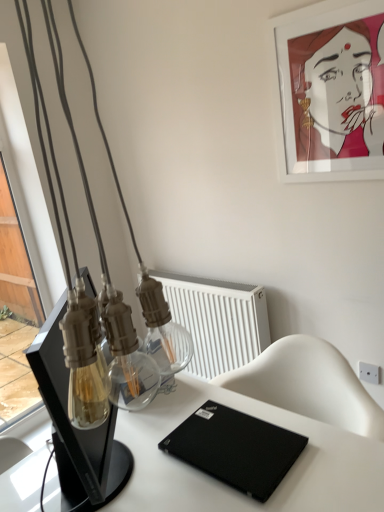
Describe the element at coordinates (235, 448) in the screenshot. I see `black matte laptop at lower right` at that location.

I want to click on white plastic electric outlet at upper right, so click(x=369, y=373).

Find the location of `white matte picture frame at upper right`. white matte picture frame at upper right is located at coordinates (330, 93).

Would you say black matte laptop at lower right is outside black matte laptop at center?

No, black matte laptop at lower right is inside black matte laptop at center's boundary.

Can you confirm if black matte laptop at lower right is bigger than black matte laptop at center?

No.

Is black matte laptop at lower right positioned with its back to black matte laptop at center?

Absolutely, black matte laptop at lower right is directed away from black matte laptop at center.

From a real-world perspective, relative to black matte laptop at center, is black matte laptop at lower right vertically above or below?

black matte laptop at lower right is situated higher than black matte laptop at center in the real world.

Considering the relative sizes of black matte laptop at lower right and white matte picture frame at upper right in the image provided, is black matte laptop at lower right bigger than white matte picture frame at upper right?

No, black matte laptop at lower right is not bigger than white matte picture frame at upper right.

Is black matte laptop at lower right oriented away from white matte picture frame at upper right?

black matte laptop at lower right does not have its back to white matte picture frame at upper right.

Is point (278, 426) closer to viewer compared to point (320, 16)?

Yes, point (278, 426) is closer to viewer.

From a real-world perspective, is black matte laptop at lower right on white matte picture frame at upper right?

No, from a real-world perspective, black matte laptop at lower right is not above white matte picture frame at upper right.

From a real-world perspective, between clear glass bottle at center and black matte laptop at lower right, who is vertically higher?

clear glass bottle at center is physically above.

Between clear glass bottle at center and black matte laptop at lower right, which one has larger width?

black matte laptop at lower right.

Is clear glass bottle at center bigger or smaller than black matte laptop at lower right?

In the image, clear glass bottle at center appears to be smaller than black matte laptop at lower right.

Considering the positions of objects black matte laptop at lower right and white plastic radiator at center in the image provided, who is in front, black matte laptop at lower right or white plastic radiator at center?

black matte laptop at lower right is closer to the camera.

Consider the image. Considering the sizes of black matte laptop at lower right and white plastic radiator at center in the image, is black matte laptop at lower right wider or thinner than white plastic radiator at center?

Considering their sizes, black matte laptop at lower right looks broader than white plastic radiator at center.

Could white plastic radiator at center be considered to be inside black matte laptop at lower right?

That's incorrect, white plastic radiator at center is not inside black matte laptop at lower right.

In the scene shown: Which object is positioned more to the left, black matte laptop at lower right or white plastic radiator at center?

white plastic radiator at center is more to the left.

From a real-world perspective, is white plastic radiator at center located beneath white matte picture frame at upper right?

Indeed, from a real-world perspective, white plastic radiator at center is positioned beneath white matte picture frame at upper right.

Can you tell me how much white plastic radiator at center and white matte picture frame at upper right differ in facing direction?

0.00418 degrees.

From the image's perspective, would you say white plastic radiator at center is positioned over white matte picture frame at upper right?

Actually, white plastic radiator at center appears below white matte picture frame at upper right in the image.

Does white plastic radiator at center have a greater width compared to white matte picture frame at upper right?

Indeed, white plastic radiator at center has a greater width compared to white matte picture frame at upper right.

From the image's perspective, is black matte laptop at center under white matte picture frame at upper right?

Yes, from the image's perspective, black matte laptop at center is below white matte picture frame at upper right.

Can you tell me how much black matte laptop at center and white matte picture frame at upper right differ in facing direction?

There is a 0.00385-degree angle between the facing directions of black matte laptop at center and white matte picture frame at upper right.

Does point (315, 453) appear closer or farther from the camera than point (309, 67)?

Point (315, 453) is closer to the camera than point (309, 67).

From a real-world perspective, which object rests below the other?

black matte laptop at center, from a real-world perspective.

Image resolution: width=384 pixels, height=512 pixels. Identify the location of picture frame in front of the white plastic electric outlet at upper right. (330, 93).

Is white plastic electric outlet at upper right next to white matte picture frame at upper right and touching it?

No, white plastic electric outlet at upper right is not with white matte picture frame at upper right.

Considering their positions, is white plastic electric outlet at upper right located in front of or behind white matte picture frame at upper right?

Clearly, white plastic electric outlet at upper right is behind white matte picture frame at upper right.

I want to click on desk lying on the right of black matte laptop at lower right, so click(x=232, y=488).

At what (x,y) coordinates should I click in order to perform the action: click on picture frame above the black matte laptop at lower right (from the image's perspective). Please return your answer as a coordinate pair (x, y). This screenshot has height=512, width=384. Looking at the image, I should click on (330, 93).

When comparing their distances from clear glass bottle at center, does white matte picture frame at upper right or black matte laptop at center seem further?

white matte picture frame at upper right is further to clear glass bottle at center.

From the image, which object appears to be farther from white matte picture frame at upper right, clear glass bottle at center or black matte laptop at lower right?

Based on the image, clear glass bottle at center appears to be further to white matte picture frame at upper right.

Considering their positions, is black matte laptop at lower right positioned closer to white plastic radiator at center than clear glass bottle at center?

Based on the image, black matte laptop at lower right appears to be nearer to white plastic radiator at center.

From the image, which object appears to be farther from white plastic electric outlet at upper right, clear glass bottle at center or black matte laptop at center?

clear glass bottle at center lies further to white plastic electric outlet at upper right than the other object.

Considering their positions, is black matte laptop at center positioned further to white plastic electric outlet at upper right than white plastic radiator at center?

black matte laptop at center lies further to white plastic electric outlet at upper right than the other object.

Considering their positions, is white plastic radiator at center positioned closer to white plastic electric outlet at upper right than black matte laptop at lower right?

white plastic radiator at center is closer to white plastic electric outlet at upper right.

Considering their positions, is white matte picture frame at upper right positioned closer to white plastic electric outlet at upper right than clear glass bottle at center?

Among the two, white matte picture frame at upper right is located nearer to white plastic electric outlet at upper right.

Considering their positions, is white matte picture frame at upper right positioned closer to clear glass bottle at center than white plastic electric outlet at upper right?

white matte picture frame at upper right lies closer to clear glass bottle at center than the other object.

Locate an element on the screen. This screenshot has height=512, width=384. electric outlet between black matte laptop at center and white plastic radiator at center in the front-back direction is located at coordinates (369, 373).

Find the location of a particular element. This screenshot has width=384, height=512. bottle that lies between white matte picture frame at upper right and black matte laptop at center from top to bottom is located at coordinates (127, 358).

Where is `laptop positioned between black matte laptop at center and white plastic electric outlet at upper right from near to far`? The width and height of the screenshot is (384, 512). laptop positioned between black matte laptop at center and white plastic electric outlet at upper right from near to far is located at coordinates (235, 448).

Where is `electric outlet between black matte laptop at lower right and white plastic radiator at center in the front-back direction`? The image size is (384, 512). electric outlet between black matte laptop at lower right and white plastic radiator at center in the front-back direction is located at coordinates (369, 373).